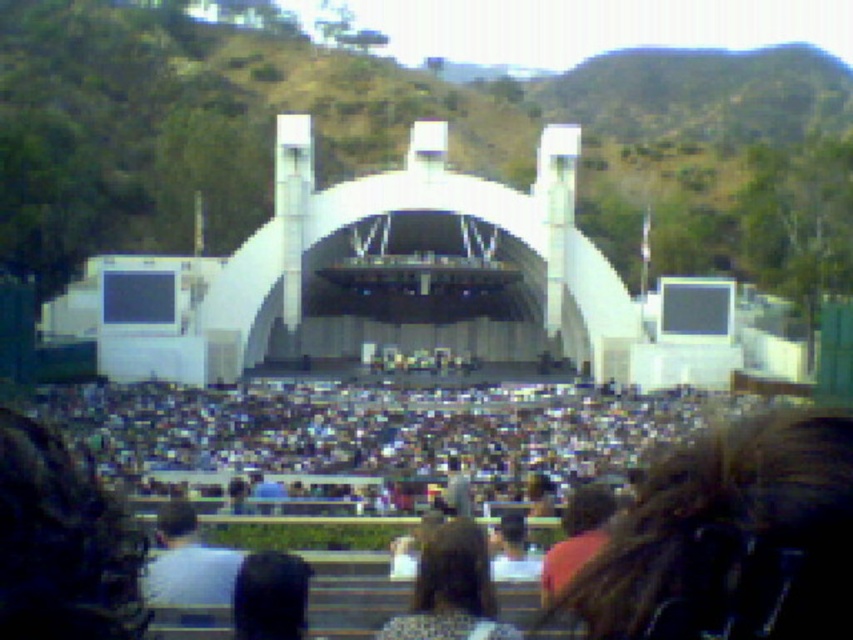
You are a photographer standing at the back of the amphitheater and want to capture a clear photo of the dark brown hair at center and the black fabric at center. Considering their heights, which one might block the other when taking the photo?

The dark brown hair at center has a greater height compared to the black fabric at center, so it might block the view of the black fabric at center in the photo.